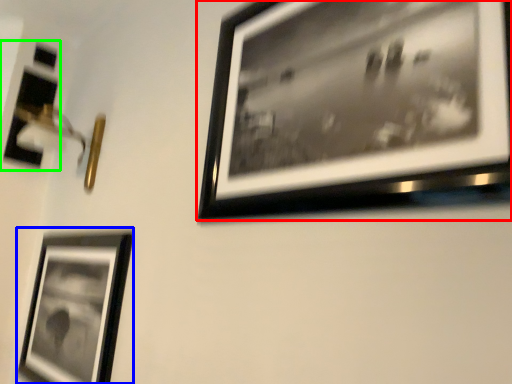
Question: Considering the real-world distances, which object is farthest from picture frame (highlighted by a red box)? picture frame (highlighted by a blue box) or picture frame (highlighted by a green box)?

Choices:
 (A) picture frame
 (B) picture frame

Answer: (B)